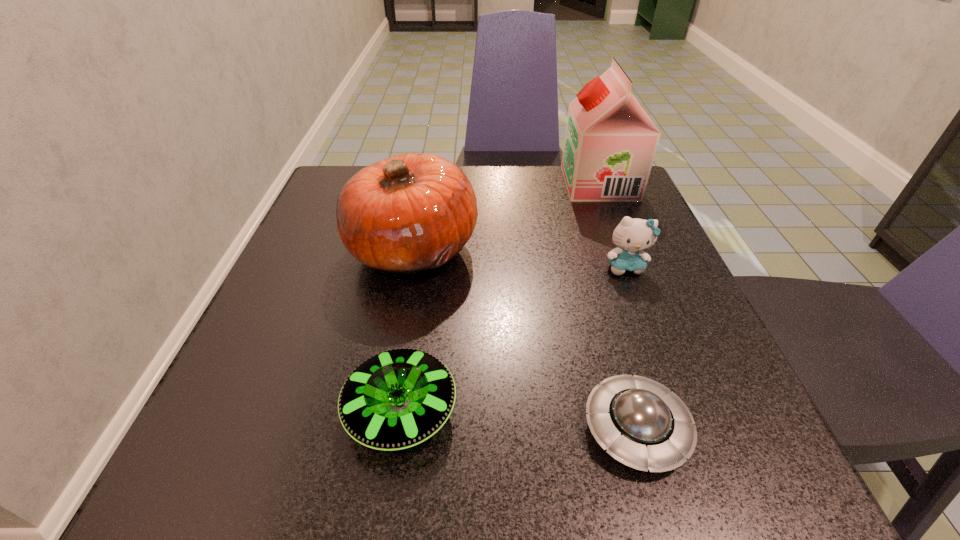
You are a GUI agent. You are given a task and a screenshot of the screen. Output one action in this format:
    pyautogui.click(x=<x>, y=<y>)
    Task: Click on the soya milk
    The image size is (960, 540).
    Given the screenshot: What is the action you would take?
    pyautogui.click(x=610, y=143)

Locate an element on the screen. The height and width of the screenshot is (540, 960). the farthest object is located at coordinates (610, 143).

Locate an element on the screen. This screenshot has height=540, width=960. pumpkin is located at coordinates (406, 214).

Locate an element on the screen. Image resolution: width=960 pixels, height=540 pixels. the third shortest object is located at coordinates (632, 236).

What are the coordinates of `the second shortest object` in the screenshot? It's located at (396, 399).

Find the location of a particular element. This screenshot has width=960, height=540. the taller saucer is located at coordinates (396, 399).

Where is `the right saucer`? The height and width of the screenshot is (540, 960). the right saucer is located at coordinates (640, 423).

Identify the location of the shorter saucer. This screenshot has width=960, height=540. (640, 423).

The width and height of the screenshot is (960, 540). I want to click on free region located with the cap open on the soya milk, so click(426, 184).

Image resolution: width=960 pixels, height=540 pixels. I want to click on free region located with the cap open on the soya milk, so click(x=426, y=184).